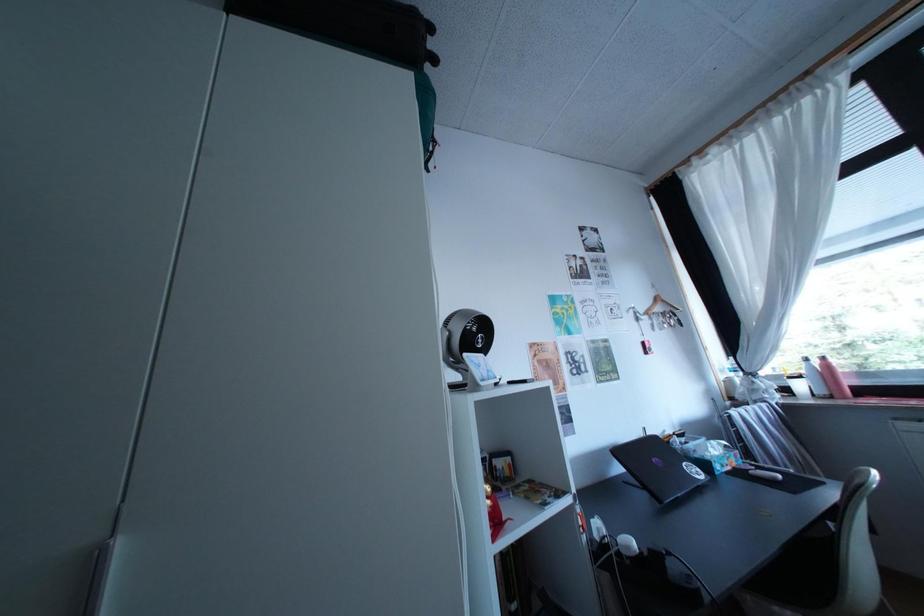
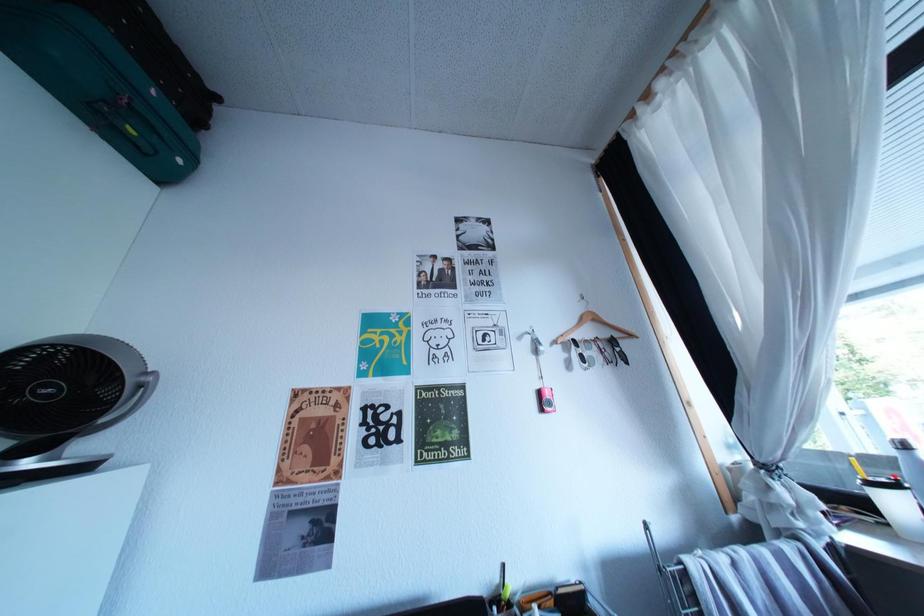
In a continuous first-person perspective shot, in which direction is the camera moving?

The movement direction of the cameraman is right, forward.